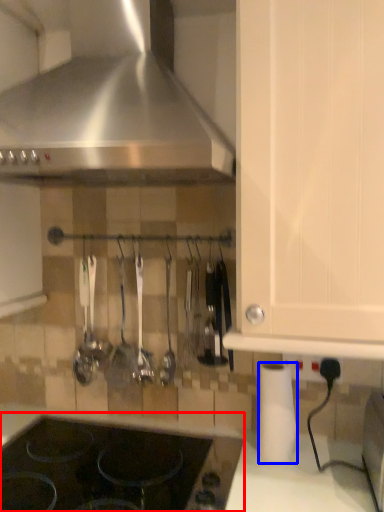
Question: Among these objects, which one is farthest to the camera, gas stove (highlighted by a red box) or paper towel (highlighted by a blue box)?

Choices:
 (A) gas stove
 (B) paper towel

Answer: (B)